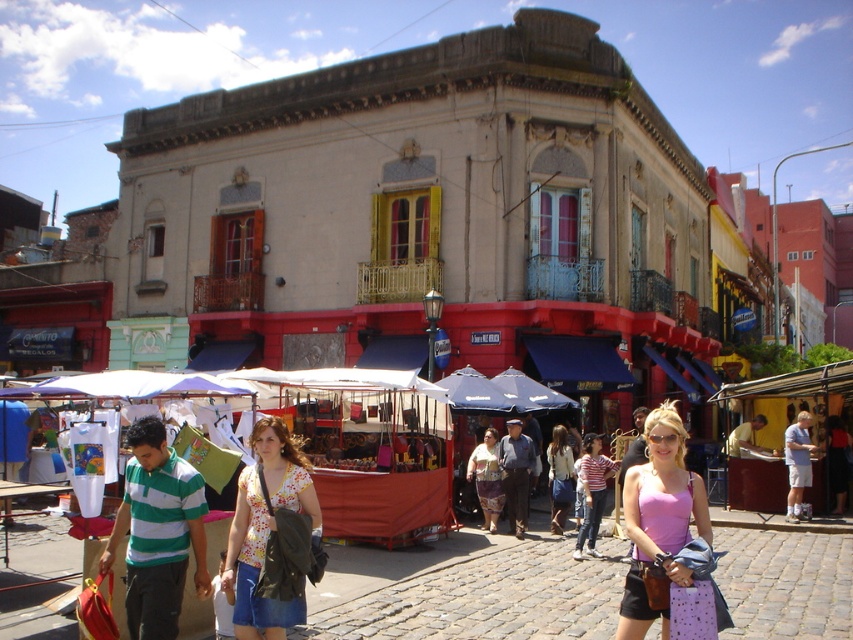
Question: Can you confirm if floral print blouse at center is positioned above floral fabric dress at center?

Choices:
 (A) yes
 (B) no

Answer: (A)

Question: Is pink fabric tank top at center wider than denim skirt at center?

Choices:
 (A) yes
 (B) no

Answer: (A)

Question: Does pink fabric tank top at center have a smaller size compared to floral fabric dress at center?

Choices:
 (A) yes
 (B) no

Answer: (B)

Question: Which is nearer to the floral fabric dress at center?

Choices:
 (A) denim skirt at center
 (B) pink fabric tank top at center

Answer: (A)

Question: Which of these objects is positioned closest to the pink fabric tank top at center?

Choices:
 (A) floral fabric dress at center
 (B) floral print blouse at center

Answer: (B)

Question: Among these points, which one is nearest to the camera?

Choices:
 (A) (624, 634)
 (B) (244, 472)

Answer: (A)